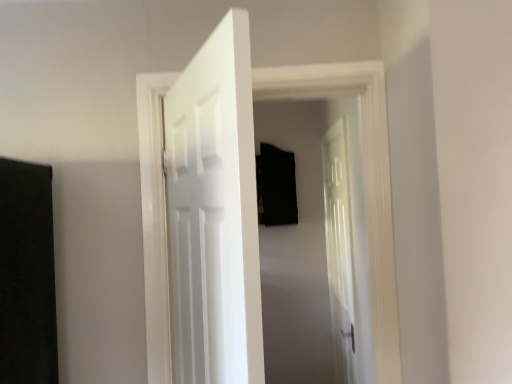
Question: Which direction should I rotate to look at white glossy door at center, placed as the first door when sorted from right to left?

Choices:
 (A) right
 (B) left

Answer: (A)

Question: Is white glossy door at center, arranged as the 3th door when viewed from the right, at the left side of white wooden door at center, the 2th door viewed from the right?

Choices:
 (A) yes
 (B) no

Answer: (A)

Question: Could you tell me if white glossy door at center, arranged as the third door when viewed from the back, is turned towards white wooden door at center, which is the second door in left-to-right order?

Choices:
 (A) no
 (B) yes

Answer: (B)

Question: Is white glossy door at center, arranged as the 3th door when viewed from the right, behind white wooden door at center, which is the second door in left-to-right order?

Choices:
 (A) no
 (B) yes

Answer: (A)

Question: From a real-world perspective, is white glossy door at center, arranged as the third door when viewed from the back, physically below white wooden door at center, which is the second door in left-to-right order?

Choices:
 (A) yes
 (B) no

Answer: (A)

Question: Is white glossy door at center, arranged as the third door when viewed from the back, not within white wooden door at center, arranged as the second door when viewed from the back?

Choices:
 (A) yes
 (B) no

Answer: (A)

Question: Is white glossy door at center, arranged as the third door when viewed from the back, positioned before white wooden door at center, arranged as the second door when viewed from the front?

Choices:
 (A) yes
 (B) no

Answer: (A)

Question: Is white glossy door at center, which is the third door from front to back, thinner than white glossy door at center, arranged as the third door when viewed from the back?

Choices:
 (A) yes
 (B) no

Answer: (B)

Question: Can you confirm if white glossy door at center, the first door when ordered from back to front, is taller than white glossy door at center, which is the 1th door from left to right?

Choices:
 (A) yes
 (B) no

Answer: (A)

Question: Considering the relative sizes of white glossy door at center, which is the third door from front to back, and white glossy door at center, arranged as the third door when viewed from the back, in the image provided, is white glossy door at center, which is the third door from front to back, wider than white glossy door at center, arranged as the third door when viewed from the back,?

Choices:
 (A) no
 (B) yes

Answer: (B)

Question: Is white glossy door at center, the first door when ordered from back to front, to the left of white glossy door at center, arranged as the third door when viewed from the back, from the viewer's perspective?

Choices:
 (A) no
 (B) yes

Answer: (A)

Question: From a real-world perspective, is white glossy door at center, which is the third door from front to back, physically below white glossy door at center, the first door in the front-to-back sequence?

Choices:
 (A) no
 (B) yes

Answer: (B)

Question: Is white glossy door at center, placed as the first door when sorted from right to left, oriented towards white glossy door at center, the first door in the front-to-back sequence?

Choices:
 (A) yes
 (B) no

Answer: (B)

Question: Considering the relative sizes of white glossy door at center, arranged as the 3th door when viewed from the right, and white glossy door at center, placed as the first door when sorted from right to left, in the image provided, is white glossy door at center, arranged as the 3th door when viewed from the right, bigger than white glossy door at center, placed as the first door when sorted from right to left,?

Choices:
 (A) yes
 (B) no

Answer: (B)